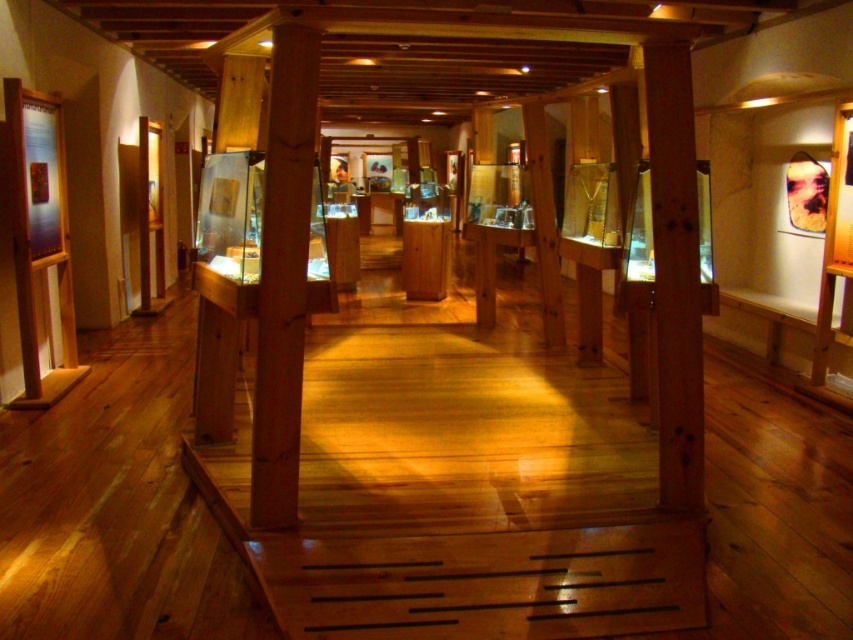
Does point (279, 218) lie in front of point (688, 195)?

Yes, point (279, 218) is closer to viewer.

Is natural wood column at center wider than wooden post at center?

Indeed, natural wood column at center has a greater width compared to wooden post at center.

Does point (294, 102) lie behind point (682, 96)?

That is False.

Where is `natural wood column at center`? The height and width of the screenshot is (640, 853). natural wood column at center is located at coordinates [283, 276].